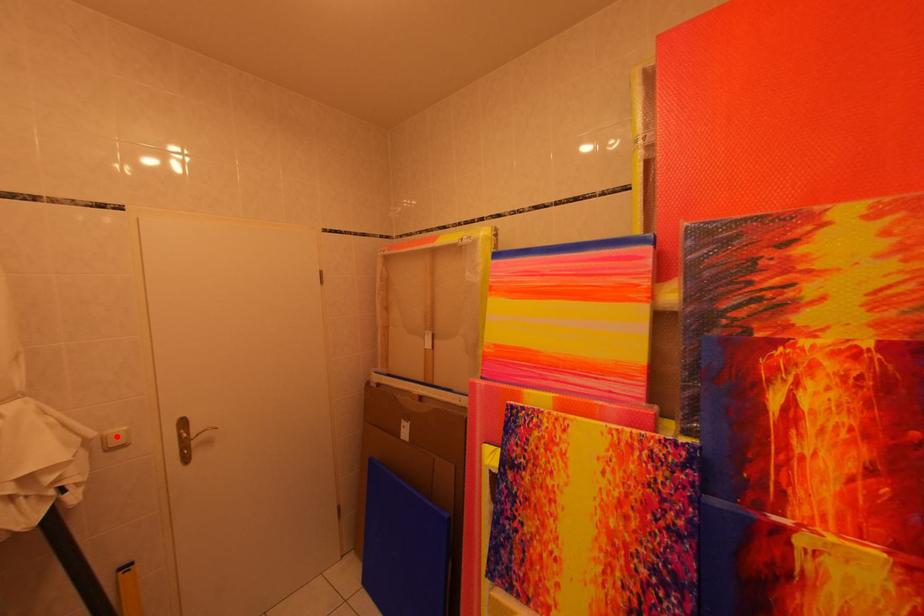
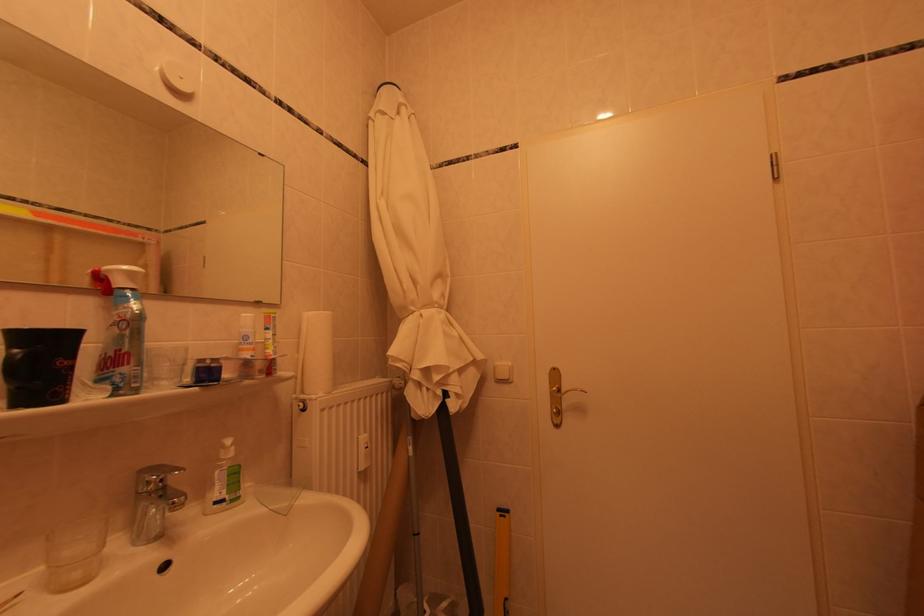
Where in the second image is the point corresponding to the highlighted location from the first image?

(506, 367)